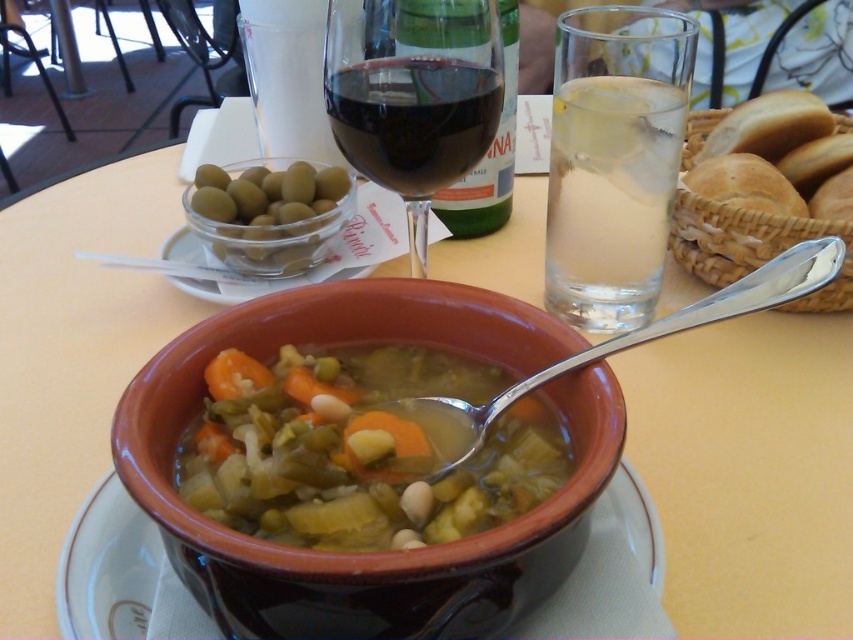
Question: Which point appears farthest from the camera in this image?

Choices:
 (A) (469, 29)
 (B) (646, 248)
 (C) (561, 554)
 (D) (219, 260)

Answer: (D)

Question: Considering the relative positions of transparent glass wine glass at center and silver metallic spoon at center in the image provided, where is transparent glass wine glass at center located with respect to silver metallic spoon at center?

Choices:
 (A) above
 (B) below

Answer: (A)

Question: Which is farther from the silver metallic spoon at center?

Choices:
 (A) orange matte carrot at center
 (B) green glass bowl at upper left
 (C) matte ceramic soup bowl at center
 (D) transparent glass wine glass at center

Answer: (B)

Question: Which object is positioned farthest from the transparent glass wine glass at center?

Choices:
 (A) orange matte carrot at center
 (B) green glass bowl at upper left

Answer: (A)

Question: Does silver metallic spoon at center appear on the left side of green glass bowl at upper left?

Choices:
 (A) no
 (B) yes

Answer: (A)

Question: Does green glass bowl at upper left appear under orange matte carrot at center?

Choices:
 (A) yes
 (B) no

Answer: (B)